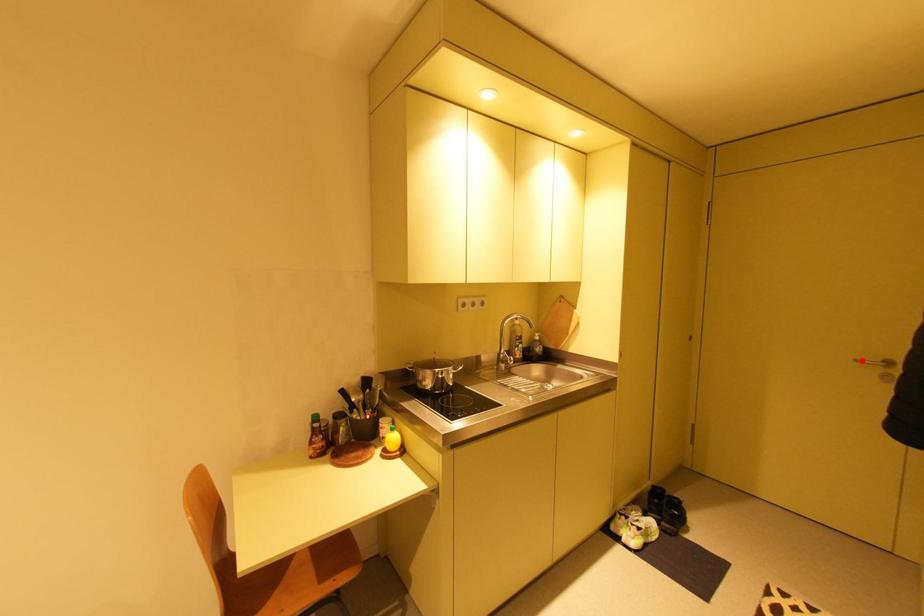
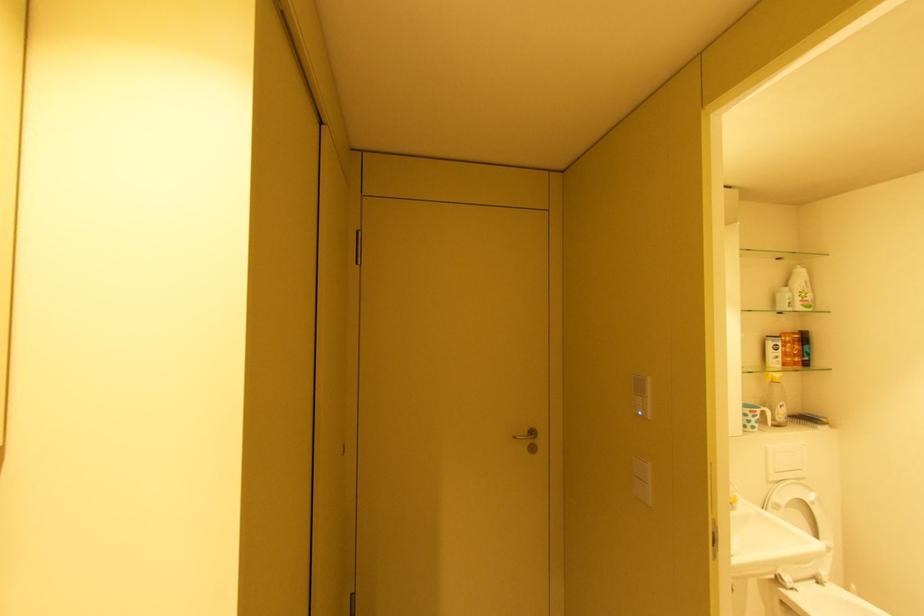
Locate, in the second image, the point that corresponds to the highlighted location in the first image.

(520, 438)